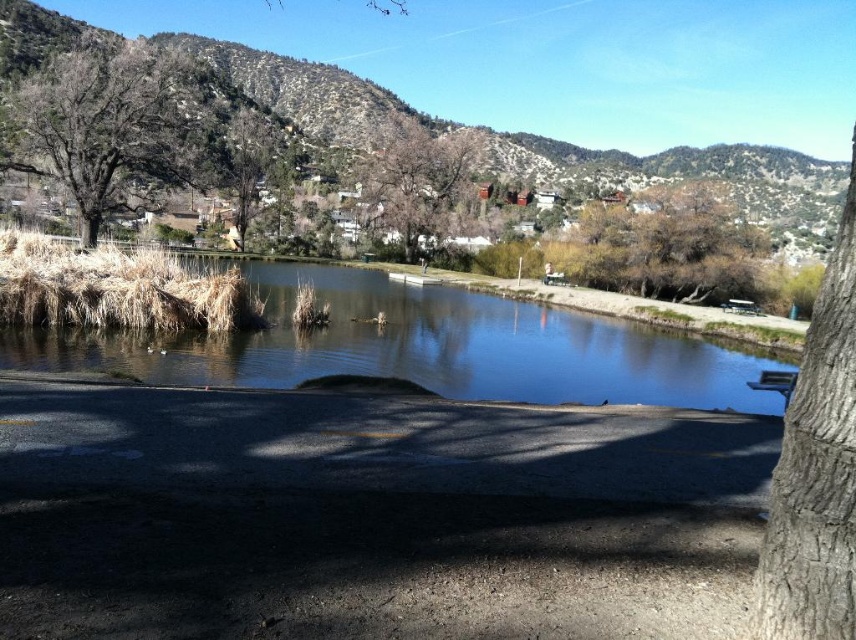
Identify the location of brown rough bark tree at right. Image resolution: width=856 pixels, height=640 pixels. (816, 470).

Which is behind, point (797, 488) or point (137, 86)?

The point (137, 86) is behind.

Locate an element on the screen. The height and width of the screenshot is (640, 856). brown rough bark tree at right is located at coordinates (816, 470).

Does point (783, 406) come in front of point (758, 307)?

Yes, it is.

Does wooden park bench at right have a larger size compared to wooden park bench at center?

No, wooden park bench at right is not bigger than wooden park bench at center.

The width and height of the screenshot is (856, 640). Identify the location of wooden park bench at right. (776, 384).

Find the location of a particular element. Image resolution: width=856 pixels, height=640 pixels. wooden park bench at right is located at coordinates (776, 384).

Is brown rough bark tree at right to the left of wooden park bench at center from the viewer's perspective?

No, brown rough bark tree at right is not to the left of wooden park bench at center.

Is brown rough bark tree at right in front of wooden park bench at center?

Yes, it is.

Which is behind, point (831, 492) or point (730, 304)?

The point (730, 304) is more distant.

What are the coordinates of `brown rough bark tree at right` in the screenshot? It's located at (x=816, y=470).